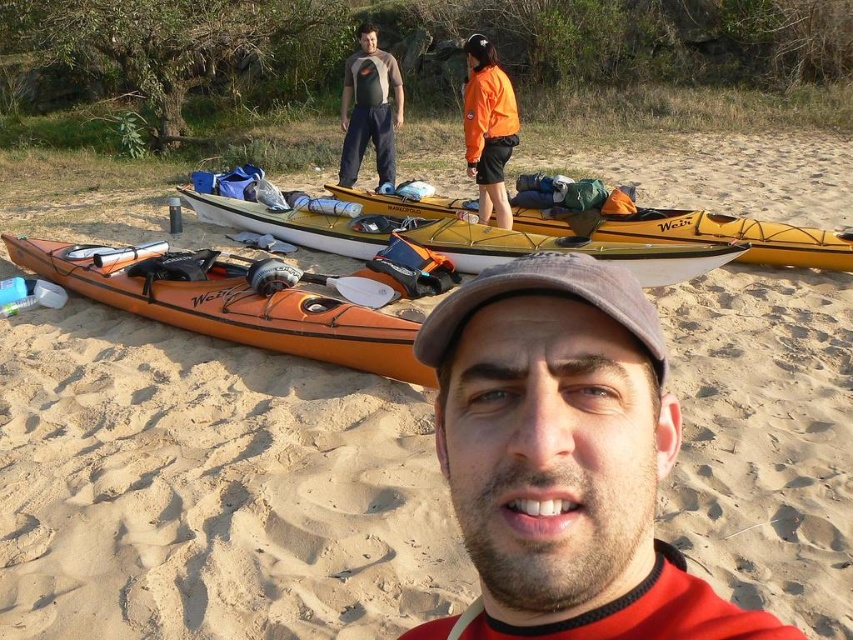
Question: Which object appears closest to the camera in this image?

Choices:
 (A) orange matte kayak at lower left
 (B) orange fleece jacket at upper center
 (C) yellow matte kayak at center
 (D) gray fabric baseball cap at center

Answer: (D)

Question: Which object appears closest to the camera in this image?

Choices:
 (A) black fabric baseball hat at upper center
 (B) orange matte kayak at lower left
 (C) gray fabric baseball cap at center

Answer: (C)

Question: Does matte gray cap at center appear on the right side of gray fabric baseball cap at center?

Choices:
 (A) no
 (B) yes

Answer: (B)

Question: Which of the following is the closest to the observer?

Choices:
 (A) (479, 58)
 (B) (405, 323)
 (C) (496, 204)
 (D) (451, 332)

Answer: (D)

Question: Can you confirm if matte gray cap at center is positioned below gray fabric baseball cap at center?

Choices:
 (A) no
 (B) yes

Answer: (B)

Question: Can you confirm if orange matte kayak at lower left is positioned to the left of matte gray t-shirt at center?

Choices:
 (A) yes
 (B) no

Answer: (A)